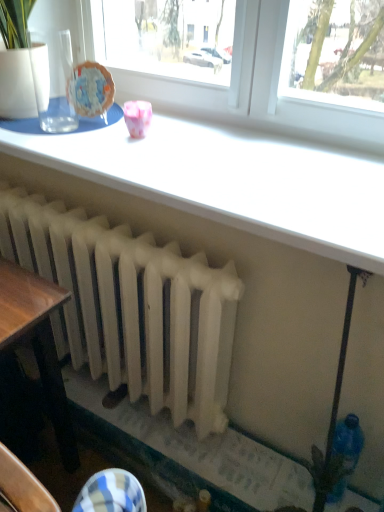
Image resolution: width=384 pixels, height=512 pixels. I want to click on free location to the right of pink glossy cup at upper center, so click(x=195, y=139).